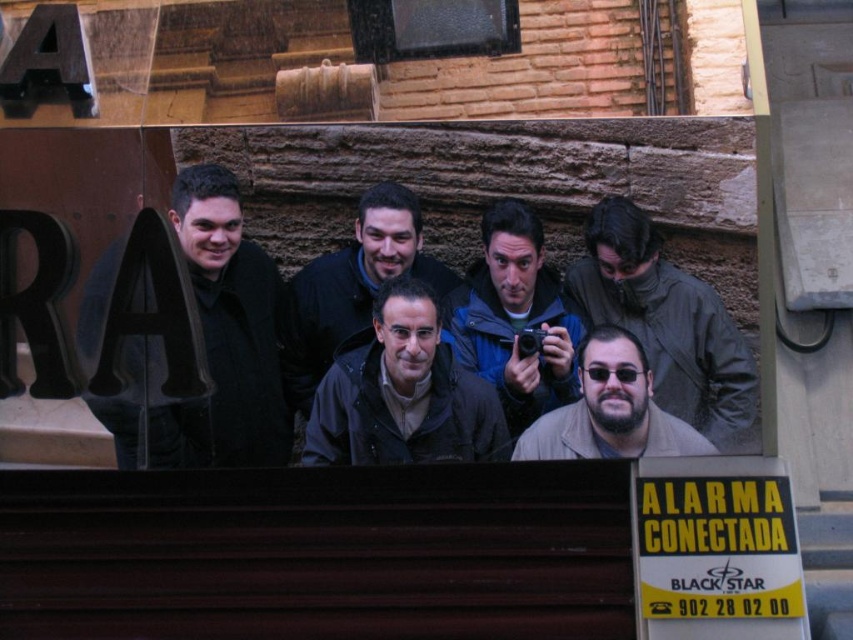
Who is higher up, yellow paper sign at lower right or beige textured jacket at center?

beige textured jacket at center is above.

Does point (677, 634) come in front of point (717, 342)?

Yes, it is.

Is point (801, 614) positioned after point (625, 214)?

That is False.

At what (x,y) coordinates should I click in order to perform the action: click on yellow paper sign at lower right. Please return your answer as a coordinate pair (x, y). The height and width of the screenshot is (640, 853). Looking at the image, I should click on (718, 557).

Is point (387, 285) closer to camera compared to point (381, 182)?

Yes, it is in front of point (381, 182).

Does dark gray jacket at center have a lesser width compared to dark blue jacket at center?

In fact, dark gray jacket at center might be wider than dark blue jacket at center.

Is point (332, 460) positioned after point (318, 308)?

No, (332, 460) is in front of (318, 308).

You are a GUI agent. You are given a task and a screenshot of the screen. Output one action in this format:
    pyautogui.click(x=<x>, y=<y>)
    Task: Click on the dark gray jacket at center
    This screenshot has width=853, height=640.
    Given the screenshot: What is the action you would take?
    pyautogui.click(x=402, y=392)

Does beige textured jacket at center have a lesser height compared to dark blue jacket at center?

In fact, beige textured jacket at center may be taller than dark blue jacket at center.

Who is more distant from viewer, (685, 396) or (372, 292)?

The point (372, 292) is behind.

At what (x,y) coordinates should I click in order to perform the action: click on beige textured jacket at center. Please return your answer as a coordinate pair (x, y). The height and width of the screenshot is (640, 853). Looking at the image, I should click on (666, 321).